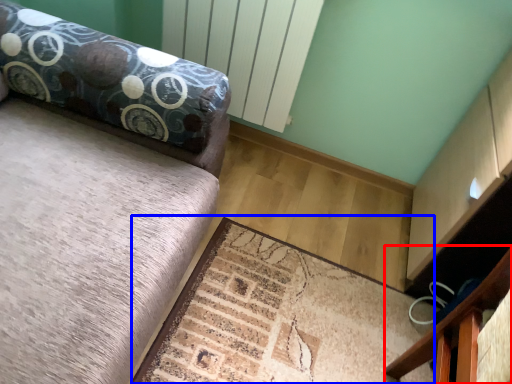
Question: Among these objects, which one is farthest to the camera, furniture (highlighted by a red box) or mat (highlighted by a blue box)?

Choices:
 (A) furniture
 (B) mat

Answer: (A)